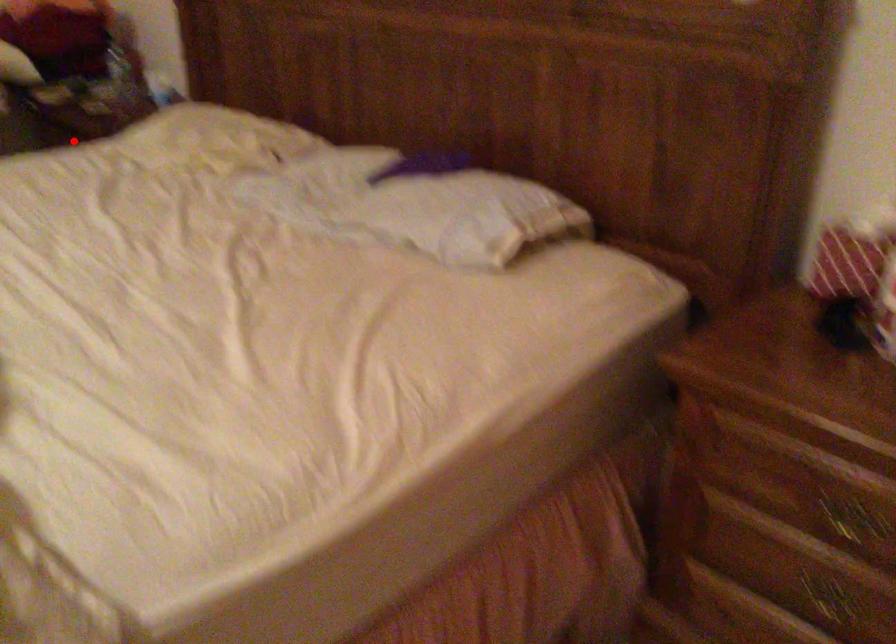
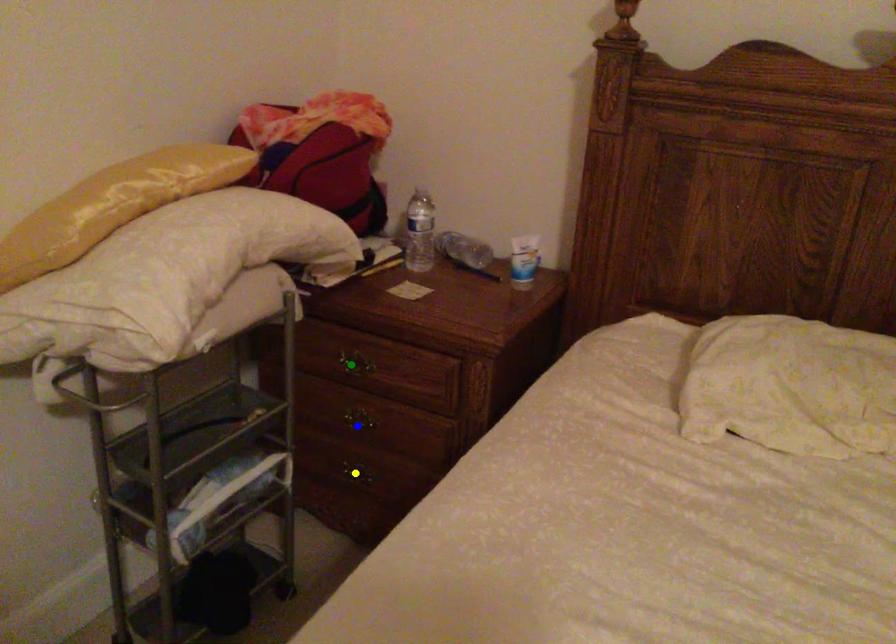
Question: I am providing you with two images of the same scene from different viewpoints. A red point is marked on the first image. You are given multiple points on the second image. Which spot in image 2 lines up with the point in image 1?

Choices:
 (A) green point
 (B) blue point
 (C) yellow point

Answer: (A)